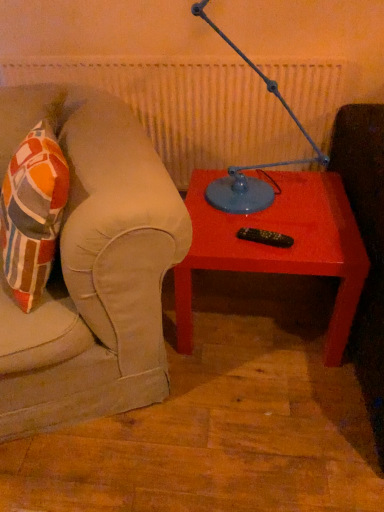
You are a GUI agent. You are given a task and a screenshot of the screen. Output one action in this format:
    pyautogui.click(x=<x>, y=<y>)
    Task: Click on the blank space situated above matte red table at center (from a real-world perspective)
    
    Given the screenshot: What is the action you would take?
    pyautogui.click(x=260, y=216)